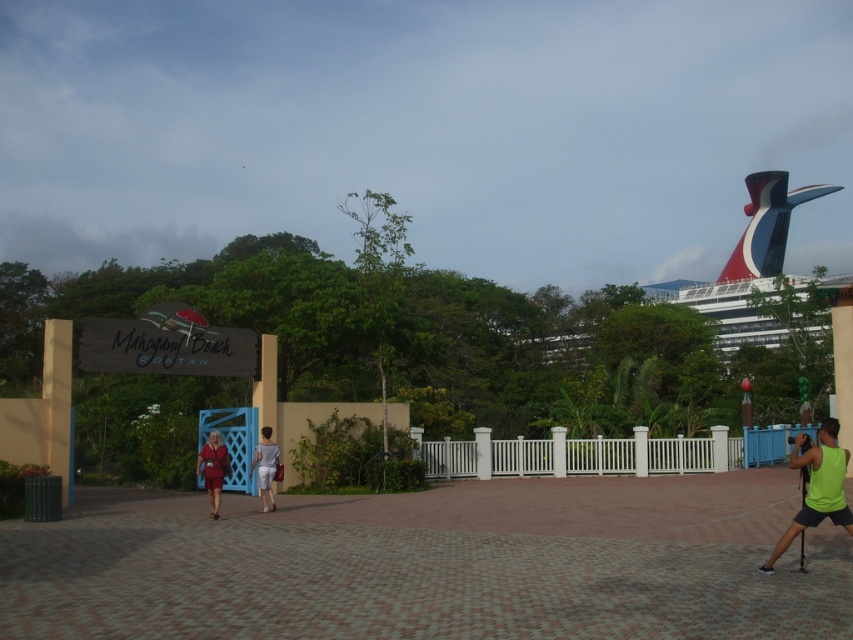
You are a photographer standing at the entrance of Mahogany Beach Roatan. You notice the polished steel cruise ship at upper right and the matte red dress at center. Which object appears taller in the scene?

The polished steel cruise ship at upper right appears taller than the matte red dress at center in the scene.